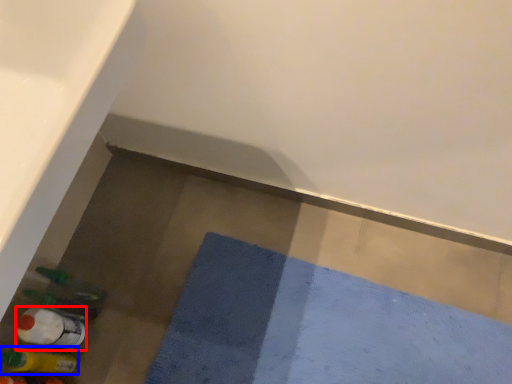
Question: Which object is further to the camera taking this photo, bottle (highlighted by a red box) or bottle (highlighted by a blue box)?

Choices:
 (A) bottle
 (B) bottle

Answer: (A)